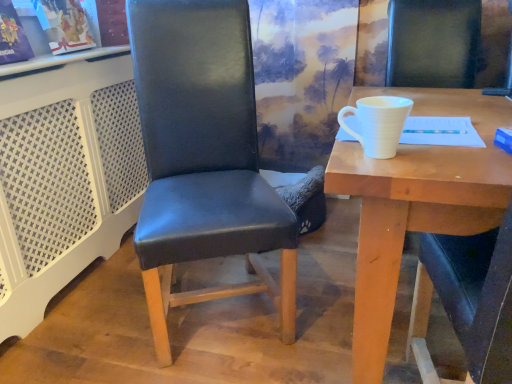
The height and width of the screenshot is (384, 512). Find the location of `vacant area that is situated to the right of black leather chair at center`. vacant area that is situated to the right of black leather chair at center is located at coordinates (321, 289).